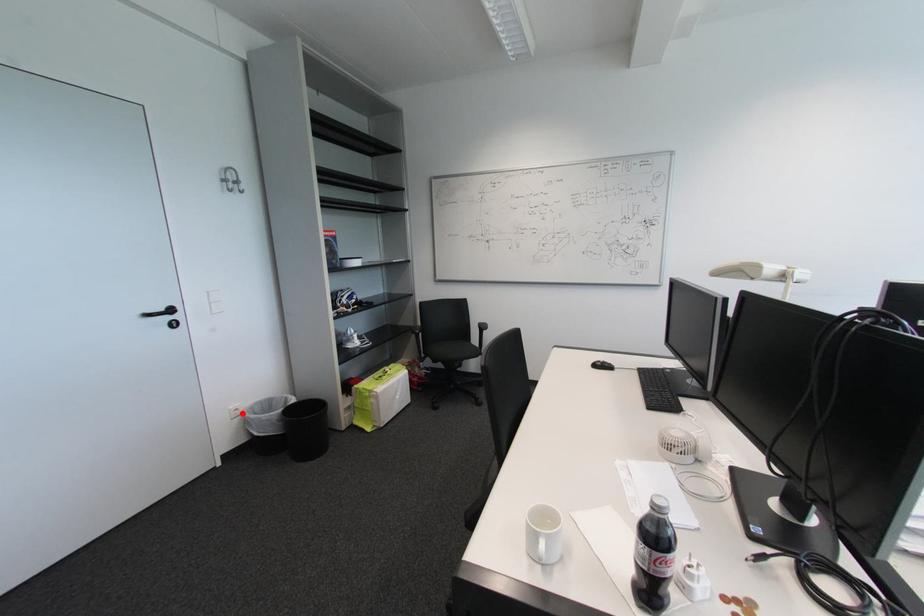
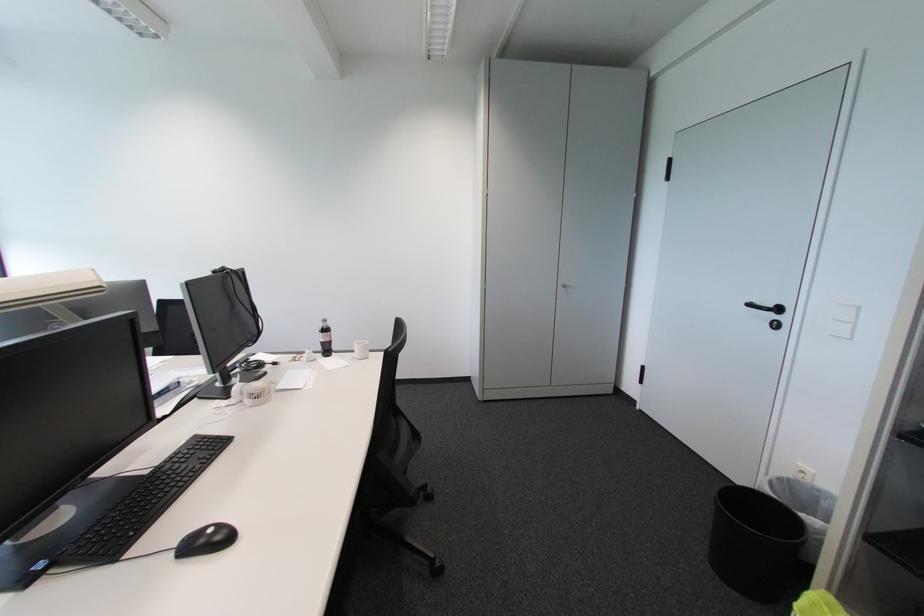
Question: I am providing you with two images of the same scene from different viewpoints. A red point is shown in image1. For the corresponding object point in image2, is it positioned nearer or farther from the camera?

Choices:
 (A) Nearer
 (B) Farther

Answer: (B)